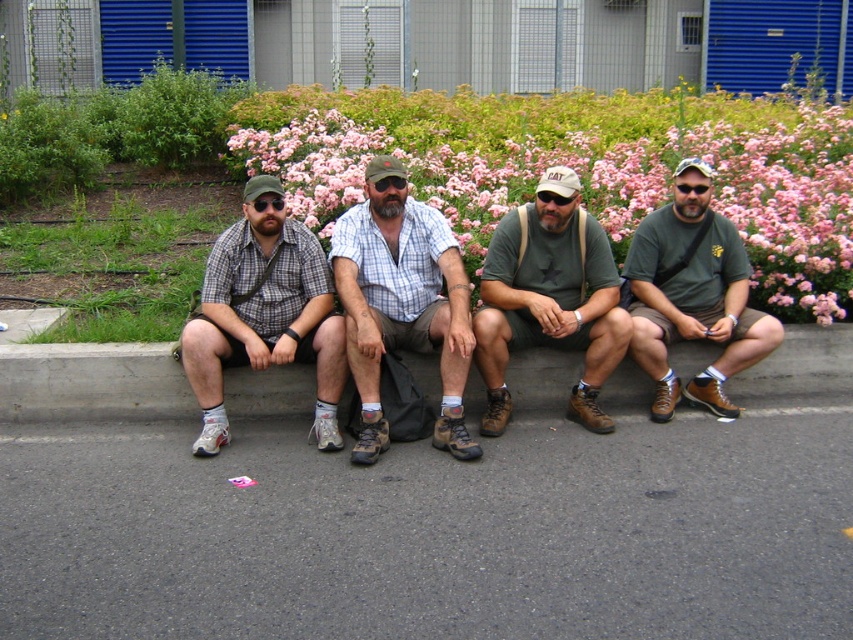
Is point (204, 292) positioned in front of point (538, 320)?

No, (204, 292) is further to viewer.

Identify the location of plaid fabric shirt at center. The height and width of the screenshot is (640, 853). (264, 316).

How distant is plaid shirt at center from matte black goggles at center?

plaid shirt at center and matte black goggles at center are 36.21 inches apart from each other.

Is point (361, 241) less distant than point (257, 202)?

No.

The image size is (853, 640). Find the location of `plaid shirt at center`. plaid shirt at center is located at coordinates (401, 301).

Can you confirm if plaid shirt at center is positioned to the left of plaid fabric shirt at center?

No, plaid shirt at center is not to the left of plaid fabric shirt at center.

Who is shorter, plaid shirt at center or plaid fabric shirt at center?

With less height is plaid fabric shirt at center.

You are a GUI agent. You are given a task and a screenshot of the screen. Output one action in this format:
    pyautogui.click(x=<x>, y=<y>)
    Task: Click on the plaid shirt at center
    
    Given the screenshot: What is the action you would take?
    pyautogui.click(x=401, y=301)